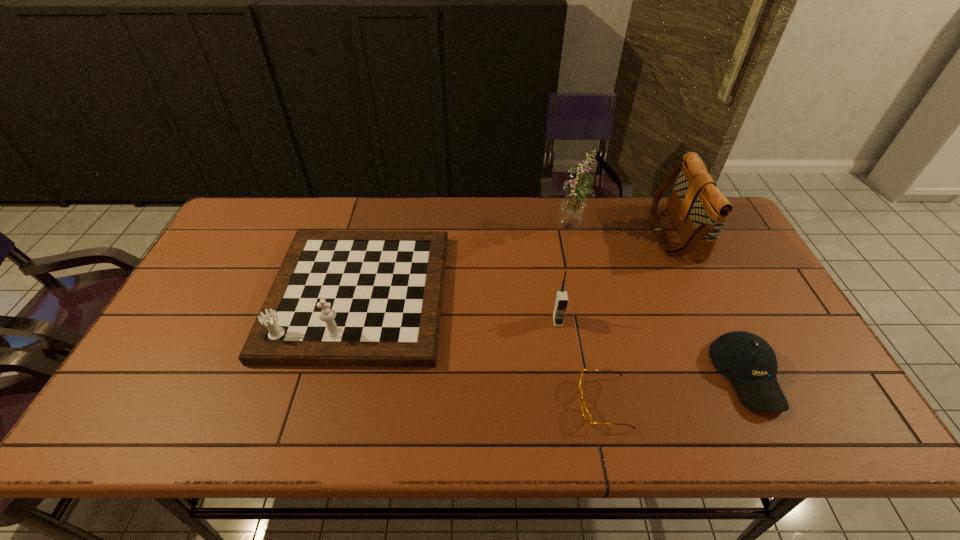
Locate an element on the screen. This screenshot has height=540, width=960. the tallest object is located at coordinates (572, 211).

Locate an element on the screen. Image resolution: width=960 pixels, height=540 pixels. shoulder bag is located at coordinates (699, 209).

What are the coordinates of `the second object from left to right` in the screenshot? It's located at (561, 299).

Where is `gameboard`? The image size is (960, 540). gameboard is located at coordinates [340, 298].

Where is `baseball cap`? The image size is (960, 540). baseball cap is located at coordinates (750, 364).

This screenshot has height=540, width=960. Identify the location of spectacles. (586, 413).

The width and height of the screenshot is (960, 540). I want to click on vacant space located on the front-facing side of the bouquet, so click(x=516, y=231).

Locate an element on the screen. The height and width of the screenshot is (540, 960). vacant space situated 0.340m on the front-facing side of the bouquet is located at coordinates (449, 231).

Where is `vacant position located on the front-facing side of the bouquet`? vacant position located on the front-facing side of the bouquet is located at coordinates (538, 231).

Locate an element on the screen. This screenshot has height=540, width=960. vacant space located on the front-facing side of the fifth shortest object is located at coordinates (546, 233).